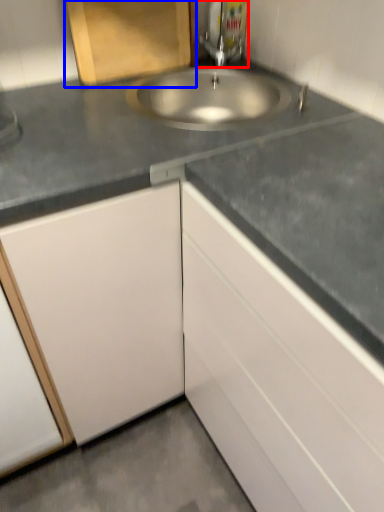
Question: Which point is further to the camera, tap (highlighted by a red box) or cabinetry (highlighted by a blue box)?

Choices:
 (A) tap
 (B) cabinetry

Answer: (A)